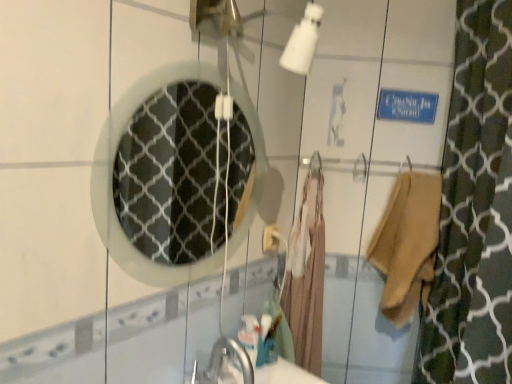
Question: Is beige fabric bathrobe at center located within beige cotton robe at right?

Choices:
 (A) no
 (B) yes

Answer: (A)

Question: Does beige cotton robe at right have a greater height compared to beige fabric bathrobe at center?

Choices:
 (A) no
 (B) yes

Answer: (A)

Question: Could you tell me if beige cotton robe at right is turned towards beige fabric bathrobe at center?

Choices:
 (A) yes
 (B) no

Answer: (B)

Question: Does beige cotton robe at right have a larger size compared to beige fabric bathrobe at center?

Choices:
 (A) yes
 (B) no

Answer: (B)

Question: Considering the relative sizes of beige cotton robe at right and beige fabric bathrobe at center in the image provided, is beige cotton robe at right smaller than beige fabric bathrobe at center?

Choices:
 (A) no
 (B) yes

Answer: (B)

Question: From a real-world perspective, relative to beige fabric bathrobe at center, is beige cotton robe at right vertically above or below?

Choices:
 (A) below
 (B) above

Answer: (B)

Question: From the image's perspective, is beige cotton robe at right above or below beige fabric bathrobe at center?

Choices:
 (A) above
 (B) below

Answer: (A)

Question: Is point (409, 311) positioned closer to the camera than point (305, 317)?

Choices:
 (A) farther
 (B) closer

Answer: (B)

Question: From their relative heights in the image, would you say beige cotton robe at right is taller or shorter than beige fabric bathrobe at center?

Choices:
 (A) short
 (B) tall

Answer: (A)

Question: In terms of height, does white textured mirror at center look taller or shorter compared to beige cotton robe at right?

Choices:
 (A) short
 (B) tall

Answer: (B)

Question: In terms of width, does white textured mirror at center look wider or thinner when compared to beige cotton robe at right?

Choices:
 (A) wide
 (B) thin

Answer: (B)

Question: Is point pos(227,188) positioned closer to the camera than point pos(396,284)?

Choices:
 (A) closer
 (B) farther

Answer: (B)

Question: Would you say white textured mirror at center is inside or outside beige cotton robe at right?

Choices:
 (A) outside
 (B) inside

Answer: (A)

Question: Is beige fabric bathrobe at center in front of or behind beige cotton robe at right in the image?

Choices:
 (A) front
 (B) behind

Answer: (B)

Question: From the image's perspective, is beige fabric bathrobe at center positioned above or below beige cotton robe at right?

Choices:
 (A) above
 (B) below

Answer: (B)